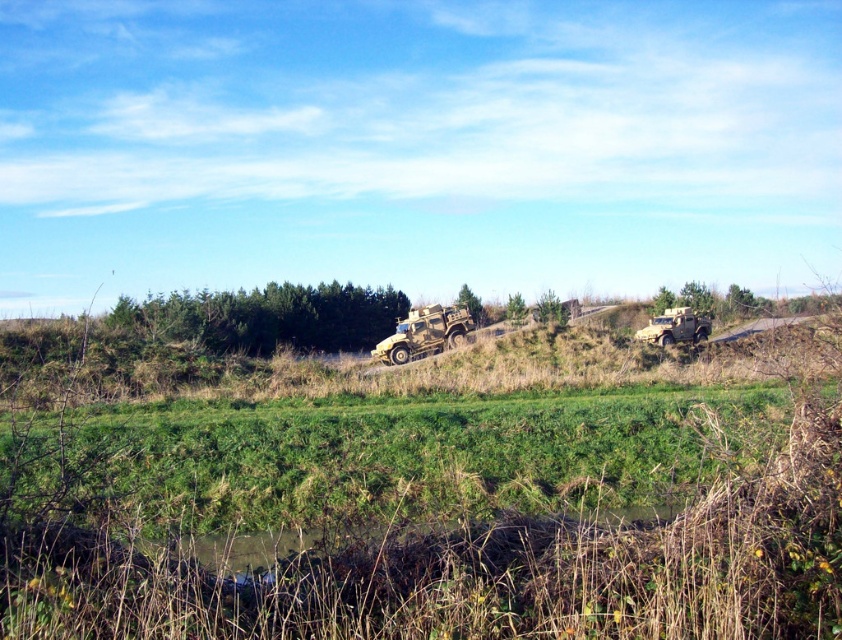
Question: From the image, what is the correct spatial relationship of camouflage fabric military vehicle at center in relation to camouflage fabric military vehicle at right?

Choices:
 (A) above
 (B) below

Answer: (A)

Question: From the image, what is the correct spatial relationship of camouflage fabric military vehicle at center in relation to camouflage fabric military vehicle at right?

Choices:
 (A) below
 (B) above

Answer: (B)

Question: Which of the following is the farthest from the observer?

Choices:
 (A) (695, 342)
 (B) (445, 308)

Answer: (B)

Question: Can you confirm if camouflage fabric military vehicle at center is thinner than camouflage fabric military vehicle at right?

Choices:
 (A) no
 (B) yes

Answer: (A)

Question: Which object is farther from the camera taking this photo?

Choices:
 (A) camouflage fabric military vehicle at right
 (B) camouflage fabric military vehicle at center

Answer: (A)